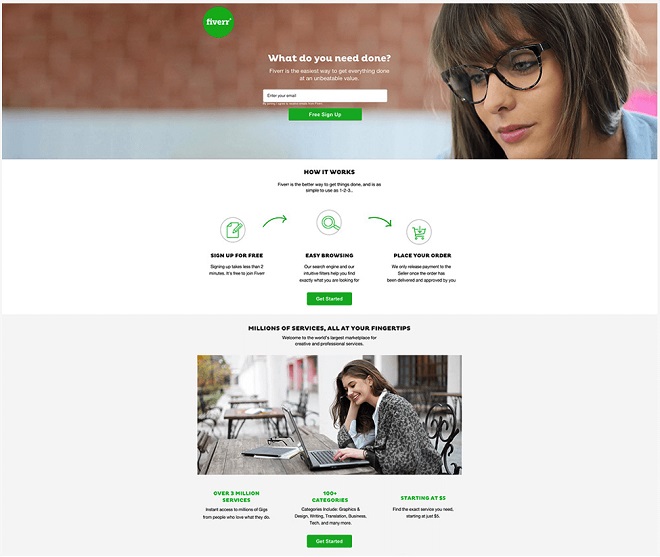
Where is `chair smiling woman is sitting in`? chair smiling woman is sitting in is located at coordinates (438, 436).